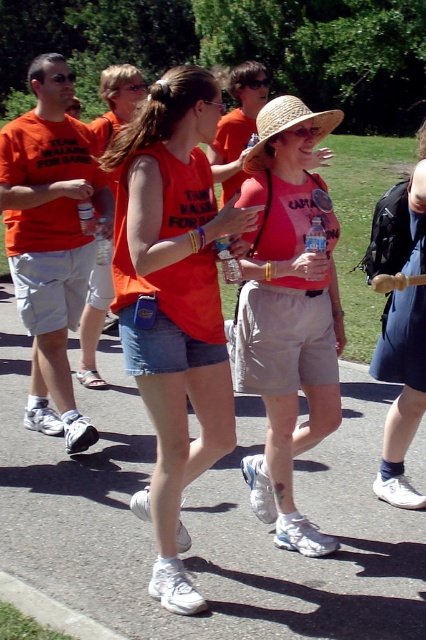
What is the exact location of the orange cotton tank top at center in the image?

The orange cotton tank top at center is located at point 0.472 on the x axis and 0.408 on the y axis.